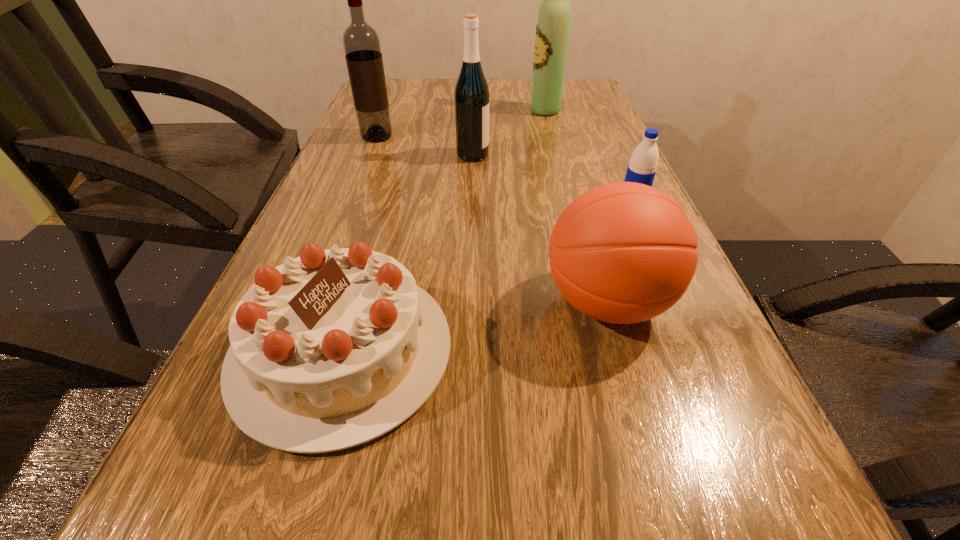
In order to click on free space that satisfies the following two spatial constraints: 1. on the front-facing side of the fourth farthest object; 2. on the right side of the farthest wine bottle in this screenshot , I will do `click(569, 204)`.